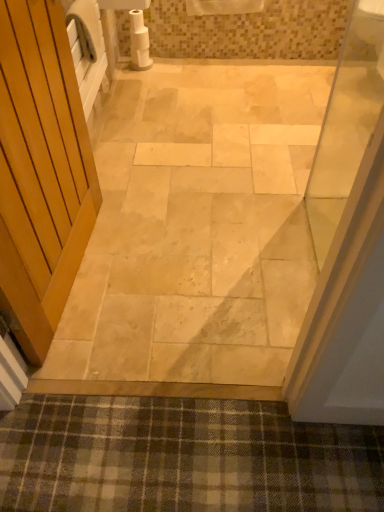
At what (x,y) coordinates should I click in order to perform the action: click on free space above natural stone floor at center (from a real-world perspective). Please return your answer as a coordinate pair (x, y). The image size is (384, 512). Looking at the image, I should click on (235, 176).